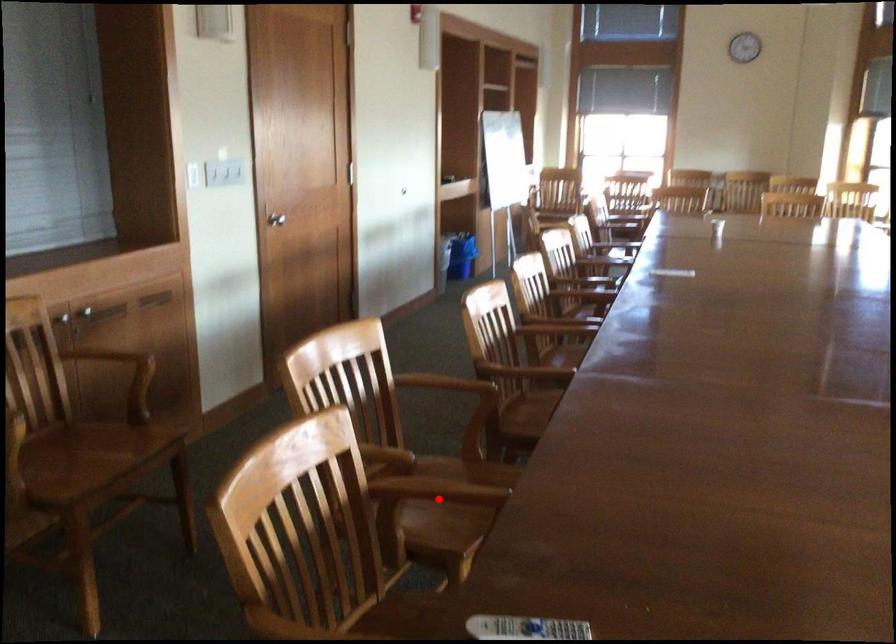
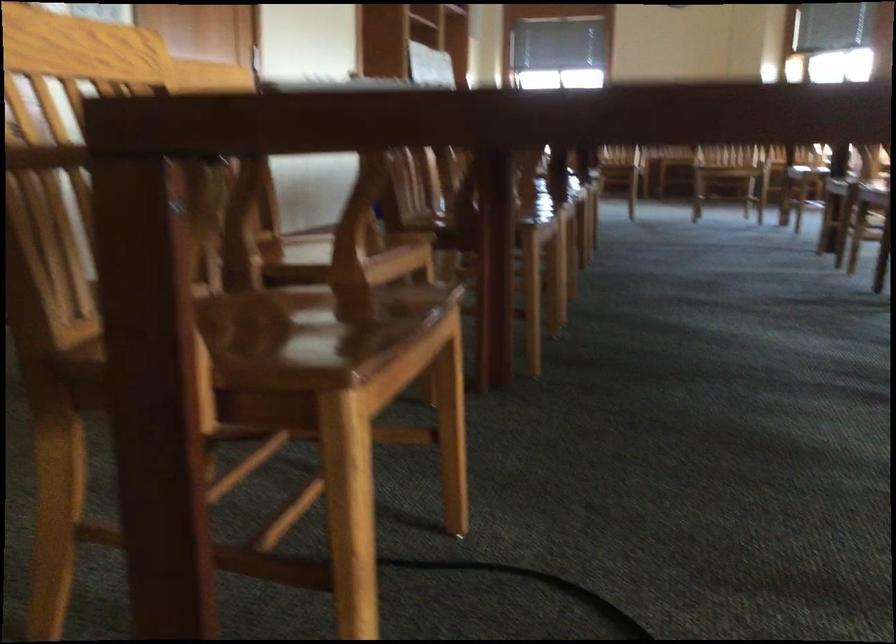
Question: I am providing you with two images of the same scene from different viewpoints. A red point is marked on the first image. Is the red point's position out of view in image 2?

Choices:
 (A) Yes
 (B) No

Answer: (A)